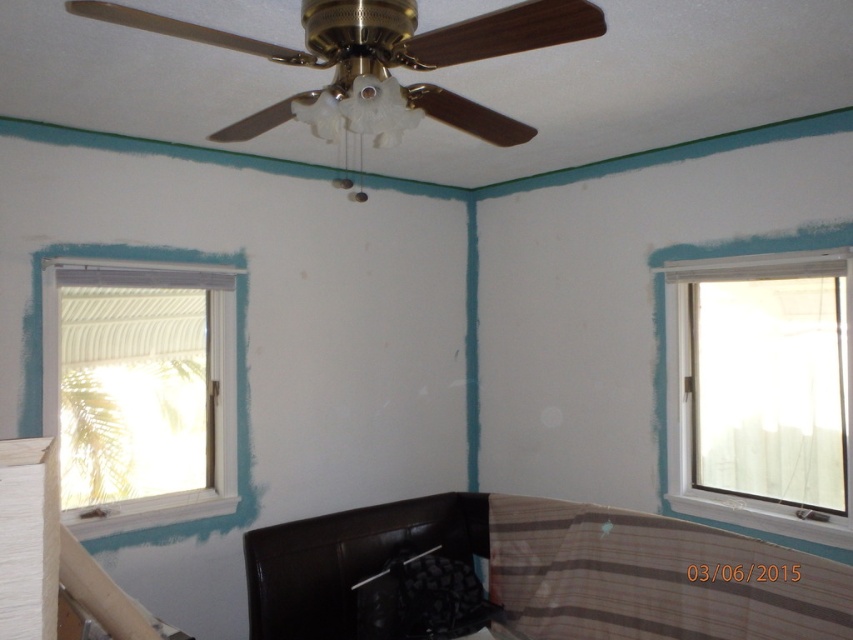
Does white painted wood window at left appear on the left side of white plastic window at upper right?

Indeed, white painted wood window at left is positioned on the left side of white plastic window at upper right.

Is white painted wood window at left below white plastic window at upper right?

Indeed, white painted wood window at left is positioned under white plastic window at upper right.

Does point (57, 384) come in front of point (775, 524)?

Yes, it is in front of point (775, 524).

Find the location of a particular element. Image resolution: width=853 pixels, height=640 pixels. white painted wood window at left is located at coordinates (154, 358).

Which is more to the left, gold metallic ceiling fan at upper center or white plastic window at upper right?

gold metallic ceiling fan at upper center is more to the left.

Consider the image. Between gold metallic ceiling fan at upper center and white plastic window at upper right, which one is positioned higher?

gold metallic ceiling fan at upper center is above.

Where is `gold metallic ceiling fan at upper center`? This screenshot has width=853, height=640. gold metallic ceiling fan at upper center is located at coordinates (381, 60).

Where is `gold metallic ceiling fan at upper center`? This screenshot has width=853, height=640. gold metallic ceiling fan at upper center is located at coordinates (381, 60).

Does brown leather bed at lower center appear on the left side of gold metallic ceiling fan at upper center?

No, brown leather bed at lower center is not to the left of gold metallic ceiling fan at upper center.

What do you see at coordinates (532, 576) in the screenshot? This screenshot has width=853, height=640. I see `brown leather bed at lower center` at bounding box center [532, 576].

The image size is (853, 640). In order to click on brown leather bed at lower center in this screenshot , I will do `click(532, 576)`.